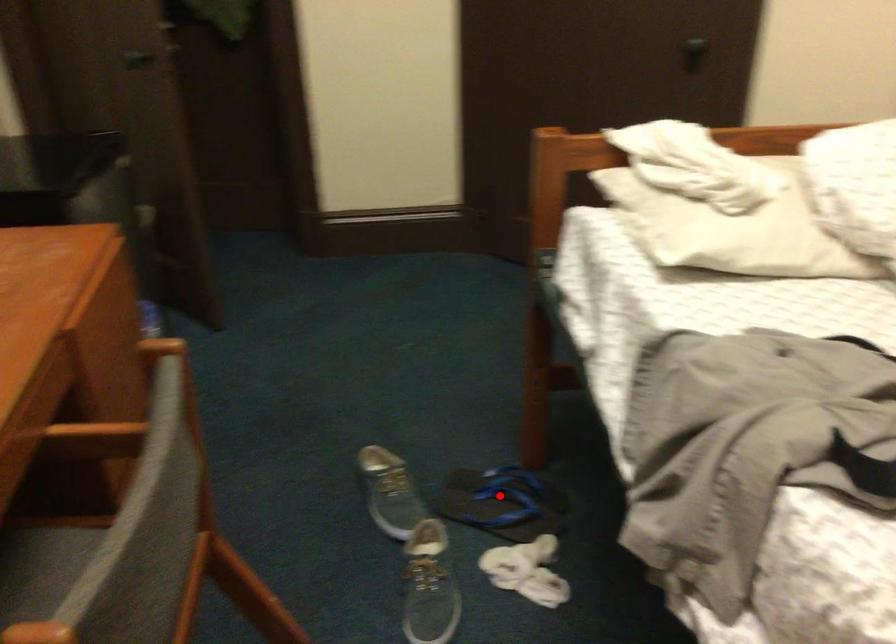
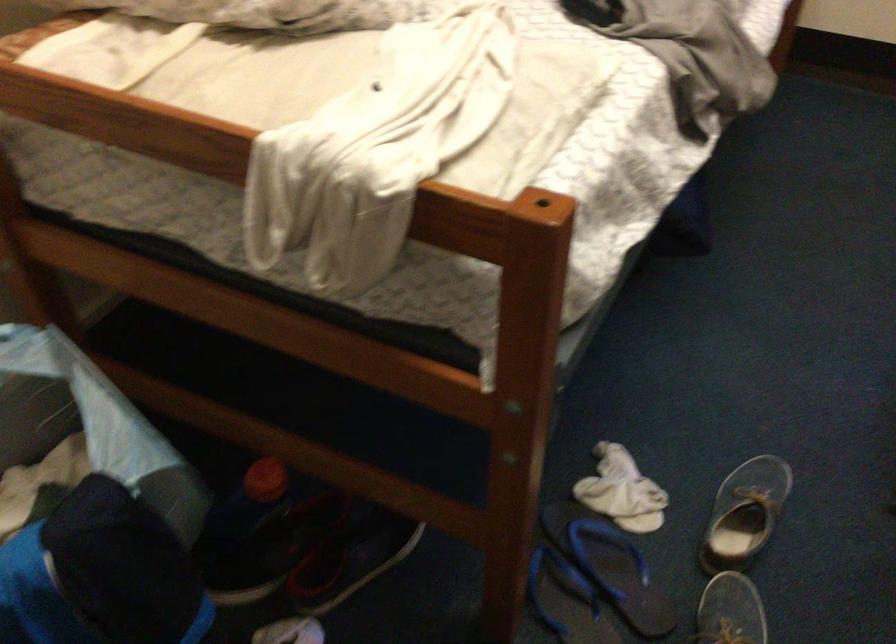
Question: I am providing you with two images of the same scene from different viewpoints. In image1, a red point is highlighted. Considering the same 3D point in image2, which of the following is correct?

Choices:
 (A) It is closer
 (B) It is farther

Answer: (A)